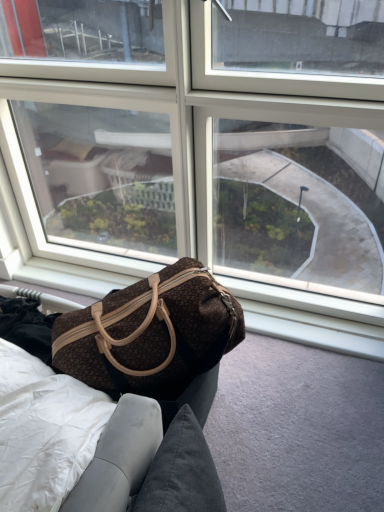
Question: In the image, is brown textured fabric bag at center positioned in front of or behind transparent glass window at center?

Choices:
 (A) behind
 (B) front

Answer: (B)

Question: Is brown textured fabric bag at center bigger or smaller than transparent glass window at center?

Choices:
 (A) small
 (B) big

Answer: (A)

Question: Which object is the farthest from the brown fabric bag at lower left?

Choices:
 (A) transparent glass window at center
 (B) brown textured fabric bag at center

Answer: (A)

Question: Which is nearer to the brown fabric bag at lower left?

Choices:
 (A) brown textured fabric bag at center
 (B) transparent glass window at center

Answer: (A)